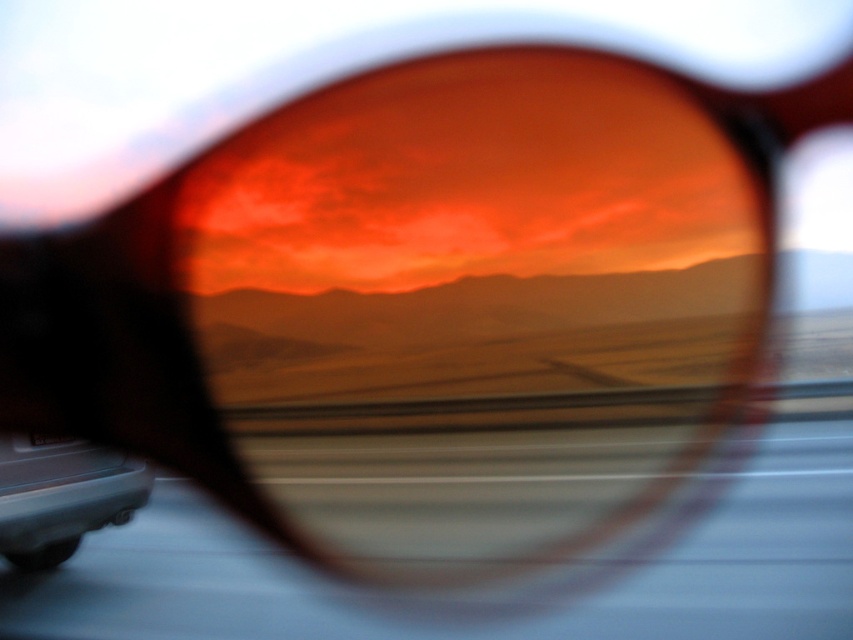
The height and width of the screenshot is (640, 853). Describe the element at coordinates (474, 252) in the screenshot. I see `matte orange lens at center` at that location.

Is matte orange lens at center further to the viewer compared to matte gray car at lower left?

Yes.

Which is in front, point (444, 250) or point (86, 525)?

Positioned in front is point (86, 525).

Where is `matte orange lens at center`? This screenshot has height=640, width=853. matte orange lens at center is located at coordinates (474, 252).